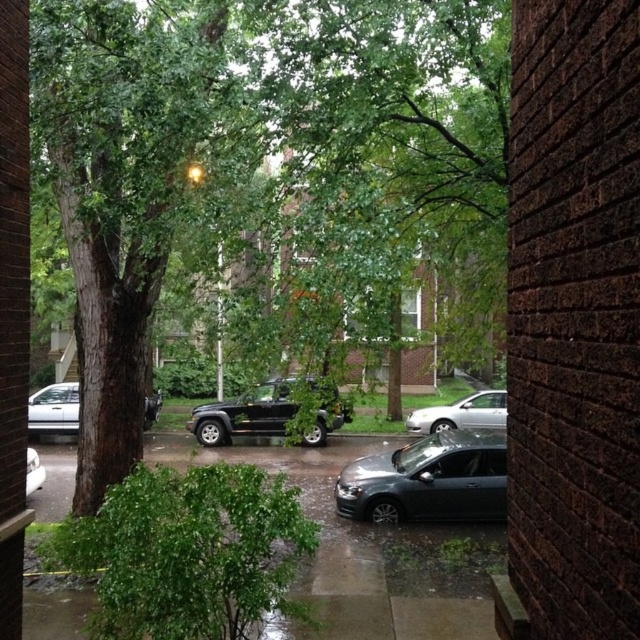
Describe the element at coordinates (52, 410) in the screenshot. I see `silver metallic sedan at left` at that location.

Identify the location of silver metallic sedan at left. This screenshot has height=640, width=640. (52, 410).

From the picture: Does green leafy tree at center have a greater width compared to silver metallic sedan at center?

No.

Is point (116, 298) positioned before point (497, 408)?

Yes.

Identify the location of green leafy tree at center. This screenshot has width=640, height=640. (260, 150).

Between silver metallic sedan at center and white matte car at left, which one has more height?

Standing taller between the two is silver metallic sedan at center.

Between silver metallic sedan at center and white matte car at left, which one has less height?

Standing shorter between the two is white matte car at left.

Is point (483, 426) positioned behind point (33, 461)?

That is True.

Find the location of a particular element. silver metallic sedan at center is located at coordinates (461, 413).